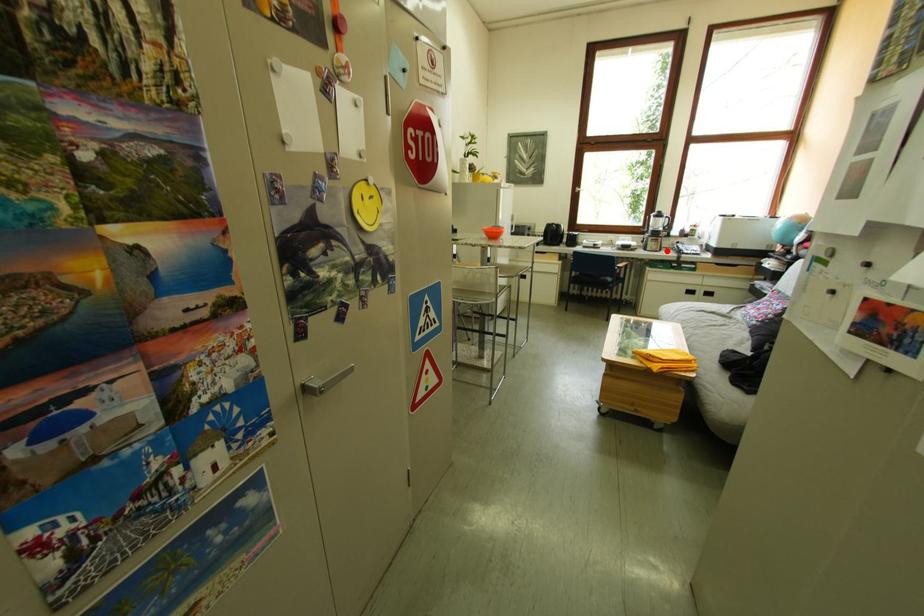
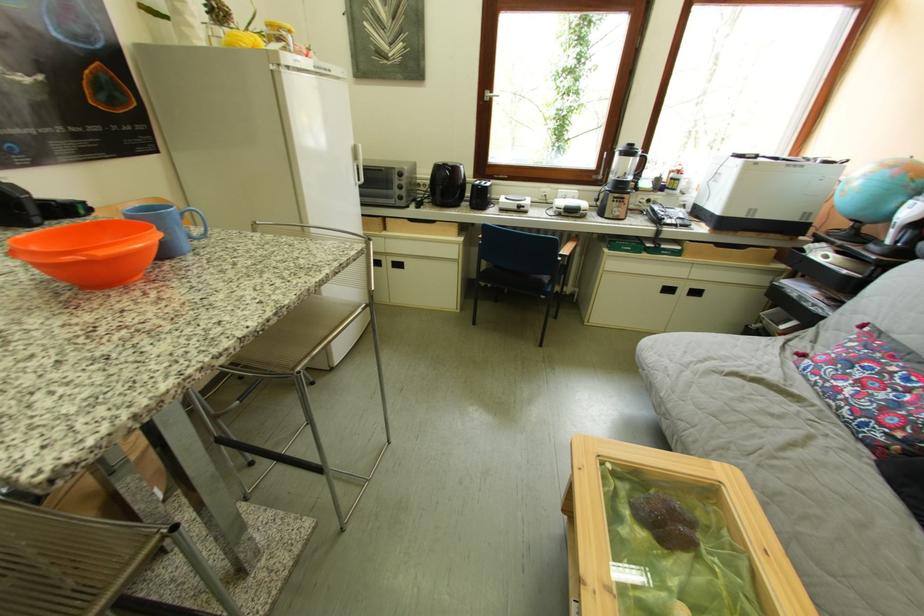
Locate, in the second image, the point that corresponds to the highlighted location in the first image.

(629, 217)